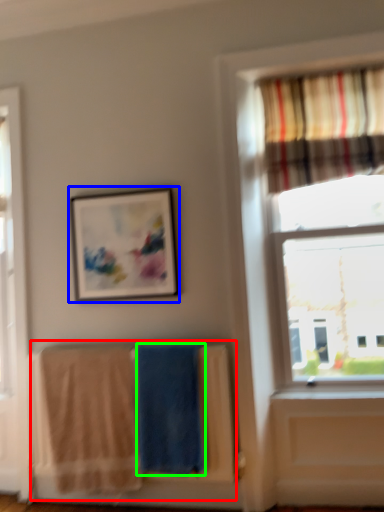
Question: Estimate the real-world distances between objects in this image. Which object is closer to laundry (highlighted by a red box), picture frame (highlighted by a blue box) or beach towel (highlighted by a green box)?

Choices:
 (A) picture frame
 (B) beach towel

Answer: (B)